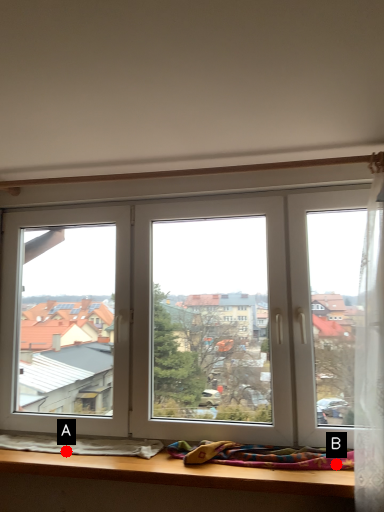
Question: Two points are circled on the image, labeled by A and B beside each circle. Which point is further to the camera?

Choices:
 (A) A is further
 (B) B is further

Answer: (A)